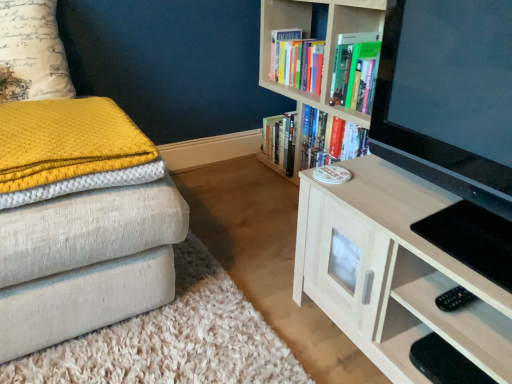
Question: From the image's perspective, would you say hardcover books at upper center, acting as the 2th book starting from the bottom, is positioned over wooden bookcase at upper right, the 1th bookcase positioned from the back?

Choices:
 (A) no
 (B) yes

Answer: (B)

Question: Is hardcover books at upper center, acting as the 2th book starting from the bottom, positioned in front of wooden bookcase at upper right, the 1th bookcase positioned from the back?

Choices:
 (A) yes
 (B) no

Answer: (B)

Question: Does hardcover books at upper center, acting as the 2th book starting from the bottom, have a lesser height compared to wooden bookcase at upper right, placed as the 2th bookcase when sorted from front to back?

Choices:
 (A) no
 (B) yes

Answer: (B)

Question: From a real-world perspective, is hardcover books at upper center, acting as the 2th book starting from the bottom, over wooden bookcase at upper right, the 1th bookcase positioned from the back?

Choices:
 (A) yes
 (B) no

Answer: (A)

Question: From the image's perspective, does hardcover books at upper center, the 1th book positioned from the top, appear lower than wooden bookcase at upper right, the 1th bookcase positioned from the back?

Choices:
 (A) no
 (B) yes

Answer: (A)

Question: Can you confirm if hardcover books at upper center, the 1th book positioned from the top, is positioned to the right of wooden bookcase at upper right, the 1th bookcase positioned from the back?

Choices:
 (A) yes
 (B) no

Answer: (B)

Question: Considering the relative positions of hardcover books at center, the 2th book viewed from the top, and yellow textured blanket at left in the image provided, is hardcover books at center, the 2th book viewed from the top, behind yellow textured blanket at left?

Choices:
 (A) yes
 (B) no

Answer: (A)

Question: Can you confirm if hardcover books at center, the 2th book viewed from the top, is bigger than yellow textured blanket at left?

Choices:
 (A) yes
 (B) no

Answer: (A)

Question: Is hardcover books at center, the 2th book viewed from the top, facing away from yellow textured blanket at left?

Choices:
 (A) no
 (B) yes

Answer: (A)

Question: From a real-world perspective, is hardcover books at center, the first book when ordered from bottom to top, positioned over yellow textured blanket at left based on gravity?

Choices:
 (A) no
 (B) yes

Answer: (A)

Question: From the image's perspective, is hardcover books at center, the first book when ordered from bottom to top, on top of yellow textured blanket at left?

Choices:
 (A) yes
 (B) no

Answer: (A)

Question: Is hardcover books at center, the first book when ordered from bottom to top, wider than yellow textured blanket at left?

Choices:
 (A) no
 (B) yes

Answer: (A)

Question: Is the position of yellow textured pillow at upper left less distant than that of hardcover books at upper center, acting as the 2th book starting from the bottom?

Choices:
 (A) no
 (B) yes

Answer: (B)